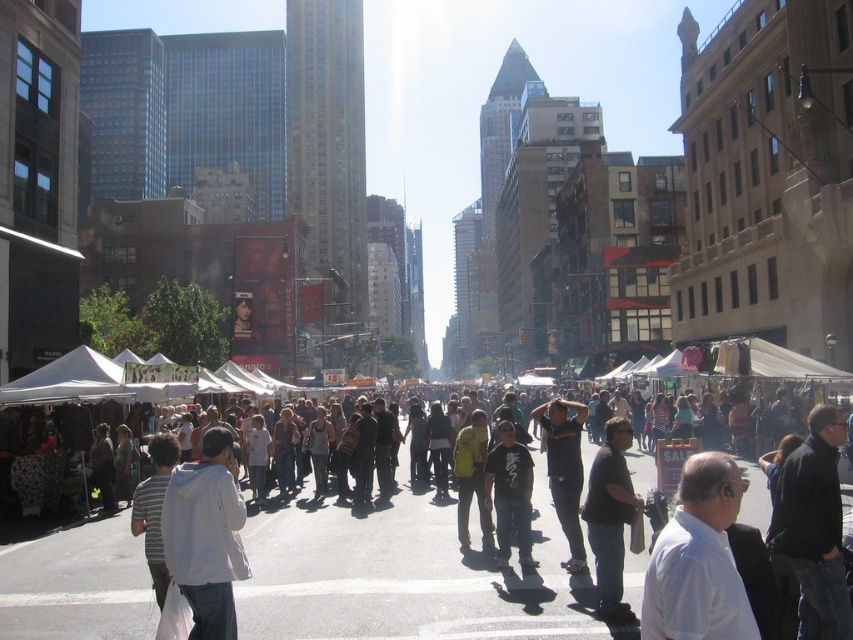
Is point (628, 605) closer to camera compared to point (486, 492)?

Yes, point (628, 605) is in front of point (486, 492).

Between point (614, 458) and point (511, 497), which one is positioned behind?

Positioned behind is point (511, 497).

Find the location of a particular element. This screenshot has height=640, width=853. black cotton shirt at center-right is located at coordinates (611, 518).

Consider the image. Is white hoodie at center shorter than dark gray pants at center?

Yes.

Can you confirm if white hoodie at center is taller than dark gray pants at center?

Incorrect, white hoodie at center's height is not larger of dark gray pants at center's.

The image size is (853, 640). I want to click on white hoodie at center, so click(206, 536).

You are a GUI agent. You are given a task and a screenshot of the screen. Output one action in this format:
    pyautogui.click(x=<x>, y=<y>)
    Task: Click on the white hoodie at center
    This screenshot has width=853, height=640.
    Given the screenshot: What is the action you would take?
    [x=206, y=536]

Is white fabric tents at center behind dark gray pants at center?

That is False.

Who is higher up, white fabric tents at center or dark gray pants at center?

dark gray pants at center

Does point (328, 529) come closer to viewer compared to point (556, 490)?

No.

This screenshot has width=853, height=640. In order to click on white fabric tents at center in this screenshot , I will do `click(404, 577)`.